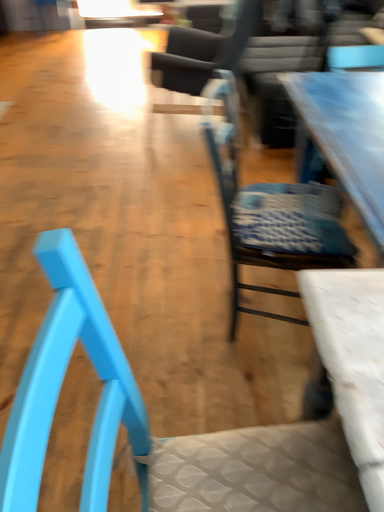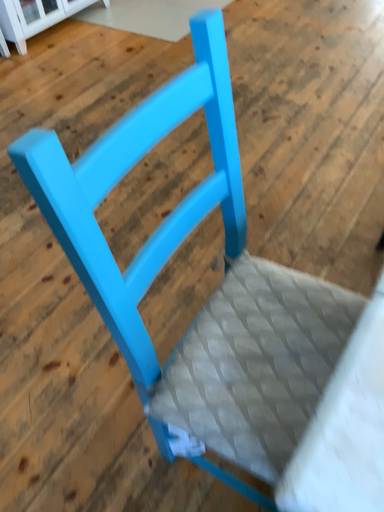
Question: How did the camera likely rotate when shooting the video?

Choices:
 (A) rotated right
 (B) rotated left

Answer: (B)